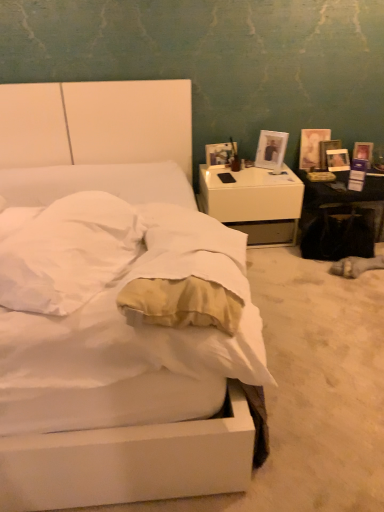
The height and width of the screenshot is (512, 384). What do you see at coordinates (271, 149) in the screenshot? I see `white glossy picture frame at upper right, positioned as the second picture frame in right-to-left order` at bounding box center [271, 149].

What is the approximate height of white glossy table at right?

5.17 inches.

What do you see at coordinates (254, 202) in the screenshot?
I see `white glossy nightstand at upper right` at bounding box center [254, 202].

I want to click on white glossy picture frame at upper right, positioned as the second picture frame in right-to-left order, so coord(271,149).

Locate an element on the screen. This screenshot has height=512, width=384. bed below the white glossy picture frame at upper right, positioned as the second picture frame in right-to-left order (from the image's perspective) is located at coordinates (128, 463).

Is white matte bed at center completely or partially outside of white glossy picture frame at upper right, which appears as the first picture frame when viewed from the left?

white matte bed at center lies outside white glossy picture frame at upper right, which appears as the first picture frame when viewed from the left,'s area.

Is point (137, 85) closer or farther from the camera than point (279, 157)?

Point (137, 85).

From a real-world perspective, does white matte bed at center sit lower than white glossy picture frame at upper right, marked as the second picture frame in a back-to-front arrangement?

Yes.

Is soft beige pillow at center next to white matte bed at center and touching it?

There is a gap between soft beige pillow at center and white matte bed at center.

Could you tell me if soft beige pillow at center is facing white matte bed at center?

Yes, soft beige pillow at center is turned towards white matte bed at center.

Between soft beige pillow at center and white matte bed at center, which one has larger size?

white matte bed at center.

Looking at this image, which object is thinner, soft beige pillow at center or white matte bed at center?

soft beige pillow at center.

Which is nearer, (280,154) or (18,319)?

The point (18,319) is more forward.

Is white glossy picture frame at upper right, positioned as the second picture frame in right-to-left order, far away from white soft mattress at center?

That's right, there is a large distance between white glossy picture frame at upper right, positioned as the second picture frame in right-to-left order, and white soft mattress at center.

Is white glossy picture frame at upper right, which is counted as the first picture frame, starting from the front, looking in the opposite direction of white soft mattress at center?

white glossy picture frame at upper right, which is counted as the first picture frame, starting from the front, does not have its back to white soft mattress at center.

Is matte white picture frame at right, acting as the second picture frame starting from the front, in front of or behind white glossy picture frame at upper right, which appears as the first picture frame when viewed from the left, in the image?

In the image, matte white picture frame at right, acting as the second picture frame starting from the front, appears behind white glossy picture frame at upper right, which appears as the first picture frame when viewed from the left.

Which of these two, matte white picture frame at right, the first picture frame from the right, or white glossy picture frame at upper right, which appears as the first picture frame when viewed from the left, stands taller?

With more height is white glossy picture frame at upper right, which appears as the first picture frame when viewed from the left.

Would you say white glossy picture frame at upper right, marked as the second picture frame in a back-to-front arrangement, is part of matte white picture frame at right, the first picture frame from the right,'s contents?

No, white glossy picture frame at upper right, marked as the second picture frame in a back-to-front arrangement, is not surrounded by matte white picture frame at right, the first picture frame from the right.

From a real-world perspective, is matte white picture frame at right, the 2th picture frame in the left-to-right sequence, under white glossy picture frame at upper right, marked as the second picture frame in a back-to-front arrangement?

Yes, from a real-world perspective, matte white picture frame at right, the 2th picture frame in the left-to-right sequence, is below white glossy picture frame at upper right, marked as the second picture frame in a back-to-front arrangement.

Does point (128, 209) come in front of point (219, 287)?

No.

Considering the sizes of soft beige pillow at center and white soft mattress at center in the image, is soft beige pillow at center wider or thinner than white soft mattress at center?

Clearly, soft beige pillow at center has more width compared to white soft mattress at center.

Is soft beige pillow at center located outside white soft mattress at center?

Yes, soft beige pillow at center is outside of white soft mattress at center.

Is soft beige pillow at center next to white soft mattress at center and touching it?

Absolutely, soft beige pillow at center is next to and touching white soft mattress at center.

Does white glossy table at right have a larger size compared to soft beige pillow at center?

Yes, white glossy table at right is bigger than soft beige pillow at center.

Is white glossy table at right placed right next to soft beige pillow at center?

They are not placed beside each other.

Which of these two, white glossy table at right or soft beige pillow at center, stands taller?

Standing taller between the two is soft beige pillow at center.

Is point (349, 198) farther from camera compared to point (68, 229)?

That is True.

Does white glossy table at right touch white soft mattress at center?

There is a gap between white glossy table at right and white soft mattress at center.

Considering the positions of point (322, 182) and point (179, 333), is point (322, 182) closer or farther from the camera than point (179, 333)?

Point (322, 182) is farther from the camera than point (179, 333).

From a real-world perspective, who is located higher, white glossy table at right or white soft mattress at center?

white soft mattress at center, from a real-world perspective.

In the scene shown: From the image's perspective, which object appears higher, white glossy table at right or white soft mattress at center?

white glossy table at right.

The image size is (384, 512). Identify the location of bed located in front of the white glossy picture frame at upper right, marked as the second picture frame in a back-to-front arrangement. (128, 463).

Identify the location of pillow behind the white matte bed at center. (68, 253).

From the picture: Looking at the image, which one is located further to soft beige pillow at center, white matte bed at center or white glossy picture frame at upper right, which is counted as the first picture frame, starting from the front?

Among the two, white glossy picture frame at upper right, which is counted as the first picture frame, starting from the front, is located further to soft beige pillow at center.

From the image, which object appears to be farther from soft beige pillow at center, white soft mattress at center or white glossy table at right?

white glossy table at right is further to soft beige pillow at center.

From the image, which object appears to be nearer to soft beige pillow at center, white glossy picture frame at upper right, marked as the second picture frame in a back-to-front arrangement, or white glossy nightstand at upper right?

white glossy nightstand at upper right is closer to soft beige pillow at center.

Considering their positions, is matte white picture frame at right, acting as the second picture frame starting from the front, positioned further to white soft mattress at center than white matte bed at center?

matte white picture frame at right, acting as the second picture frame starting from the front, is further to white soft mattress at center.

Which object lies nearer to the anchor point white glossy nightstand at upper right, matte white picture frame at right, which is the first picture frame in back-to-front order, or white glossy picture frame at upper right, positioned as the second picture frame in right-to-left order?

Based on the image, white glossy picture frame at upper right, positioned as the second picture frame in right-to-left order, appears to be nearer to white glossy nightstand at upper right.

Based on their spatial positions, is white glossy nightstand at upper right or white glossy table at right further from white matte bed at center?

white glossy table at right lies further to white matte bed at center than the other object.

From the image, which object appears to be farther from white glossy picture frame at upper right, which is counted as the first picture frame, starting from the front, white glossy table at right or white soft mattress at center?

Based on the image, white soft mattress at center appears to be further to white glossy picture frame at upper right, which is counted as the first picture frame, starting from the front.

Based on their spatial positions, is white soft mattress at center or white glossy picture frame at upper right, which is counted as the first picture frame, starting from the front, further from white glossy table at right?

white soft mattress at center lies further to white glossy table at right than the other object.

This screenshot has width=384, height=512. Identify the location of mattress between white matte bed at center and white glossy table at right in the front-back direction. (115, 295).

Locate an element on the screen. nightstand between white soft mattress at center and white glossy table at right in the front-back direction is located at coordinates (254, 202).

Locate an element on the screen. This screenshot has height=512, width=384. mattress between white matte bed at center and matte white picture frame at right, which is the first picture frame in back-to-front order, from front to back is located at coordinates (115, 295).

This screenshot has height=512, width=384. Find the location of `pillow located between white soft mattress at center and white glossy picture frame at upper right, which is counted as the first picture frame, starting from the front, in the depth direction`. pillow located between white soft mattress at center and white glossy picture frame at upper right, which is counted as the first picture frame, starting from the front, in the depth direction is located at coordinates (68, 253).